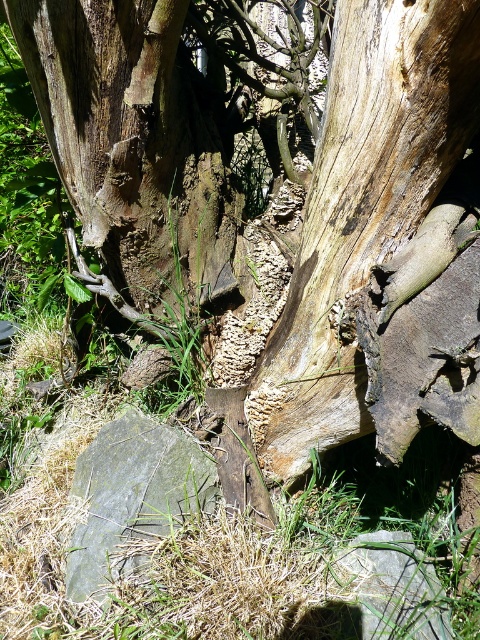
Is light brown rough bark at center above gray slate rock at lower left?

A: Indeed, light brown rough bark at center is positioned over gray slate rock at lower left.

Who is higher up, light brown rough bark at center or gray slate rock at lower left?

light brown rough bark at center is above.

The width and height of the screenshot is (480, 640). What are the coordinates of `light brown rough bark at center` in the screenshot? It's located at (361, 208).

Locate an element on the screen. This screenshot has width=480, height=640. light brown rough bark at center is located at coordinates (361, 208).